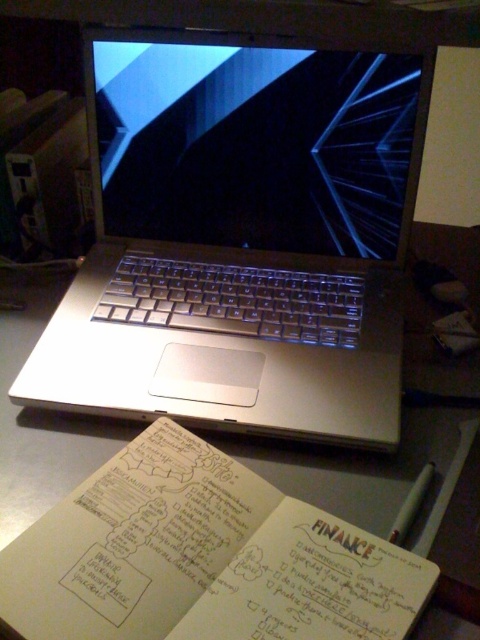
You are organizing your desk and want to place a new folder between the satin black screen at center and the white paper notebook at lower left. According to the current setup, which object is closer to you so you can slide the folder in front of it?

The satin black screen at center is closer to you than the white paper notebook at lower left, so you should slide the folder in front of the satin black screen at center.

You are setting up a new monitor stand that requires precise placement. The stand has a mounting point at coordinates 0.227, 0.533. Is the satin black screen at center positioned correctly for the stand?

The satin black screen at center is located at point (255, 145), so it is positioned correctly for the stand.